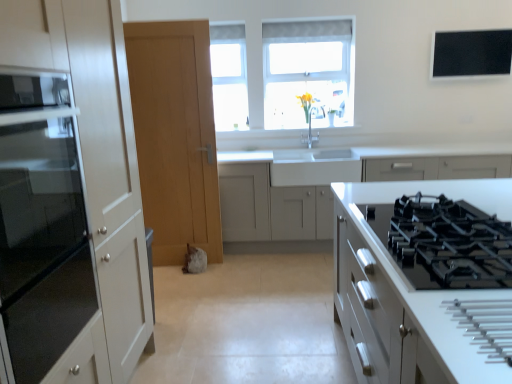
Question: Does black matte window screen at upper right turn towards white glossy stove at right, positioned as the 3th cabinetry in back-to-front order?

Choices:
 (A) no
 (B) yes

Answer: (A)

Question: Is black matte window screen at upper right further to the viewer compared to white glossy stove at right, positioned as the 3th cabinetry in back-to-front order?

Choices:
 (A) yes
 (B) no

Answer: (A)

Question: Does black matte window screen at upper right have a lesser height compared to white glossy stove at right, acting as the first cabinetry starting from the front?

Choices:
 (A) no
 (B) yes

Answer: (B)

Question: Is black matte window screen at upper right facing away from white glossy stove at right, acting as the first cabinetry starting from the front?

Choices:
 (A) no
 (B) yes

Answer: (A)

Question: Considering the relative positions of black matte window screen at upper right and white glossy stove at right, acting as the first cabinetry starting from the front, in the image provided, is black matte window screen at upper right in front of white glossy stove at right, acting as the first cabinetry starting from the front,?

Choices:
 (A) no
 (B) yes

Answer: (A)

Question: Is black matte window screen at upper right far away from white glossy stove at right, acting as the first cabinetry starting from the front?

Choices:
 (A) yes
 (B) no

Answer: (A)

Question: From the image's perspective, does white matte cabinet at center, the 3th cabinetry when ordered from front to back, appear lower than black glass gas stove at center right?

Choices:
 (A) yes
 (B) no

Answer: (B)

Question: Is white matte cabinet at center, which appears as the 1th cabinetry when viewed from the back, further to the viewer compared to black glass gas stove at center right?

Choices:
 (A) yes
 (B) no

Answer: (A)

Question: Considering the relative sizes of white matte cabinet at center, which appears as the 1th cabinetry when viewed from the back, and black glass gas stove at center right in the image provided, is white matte cabinet at center, which appears as the 1th cabinetry when viewed from the back, taller than black glass gas stove at center right?

Choices:
 (A) no
 (B) yes

Answer: (B)

Question: Considering the relative positions of white matte cabinet at center, which appears as the 1th cabinetry when viewed from the back, and black glass gas stove at center right in the image provided, is white matte cabinet at center, which appears as the 1th cabinetry when viewed from the back, to the right of black glass gas stove at center right from the viewer's perspective?

Choices:
 (A) yes
 (B) no

Answer: (A)

Question: Does white matte cabinet at center, the 3th cabinetry when ordered from front to back, appear on the left side of black glass gas stove at center right?

Choices:
 (A) no
 (B) yes

Answer: (A)

Question: Does white matte cabinet at center, which appears as the 1th cabinetry when viewed from the back, have a larger size compared to black glass gas stove at center right?

Choices:
 (A) no
 (B) yes

Answer: (B)

Question: Does clear glass window at upper center have a larger size compared to light wood door at center?

Choices:
 (A) no
 (B) yes

Answer: (A)